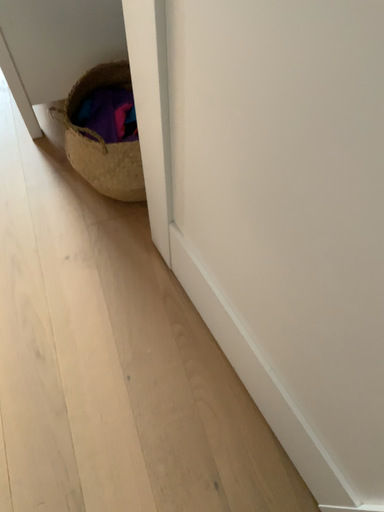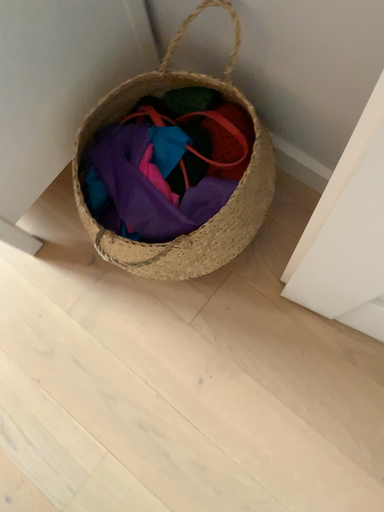
Question: How did the camera likely rotate when shooting the video?

Choices:
 (A) rotated right
 (B) rotated left

Answer: (A)